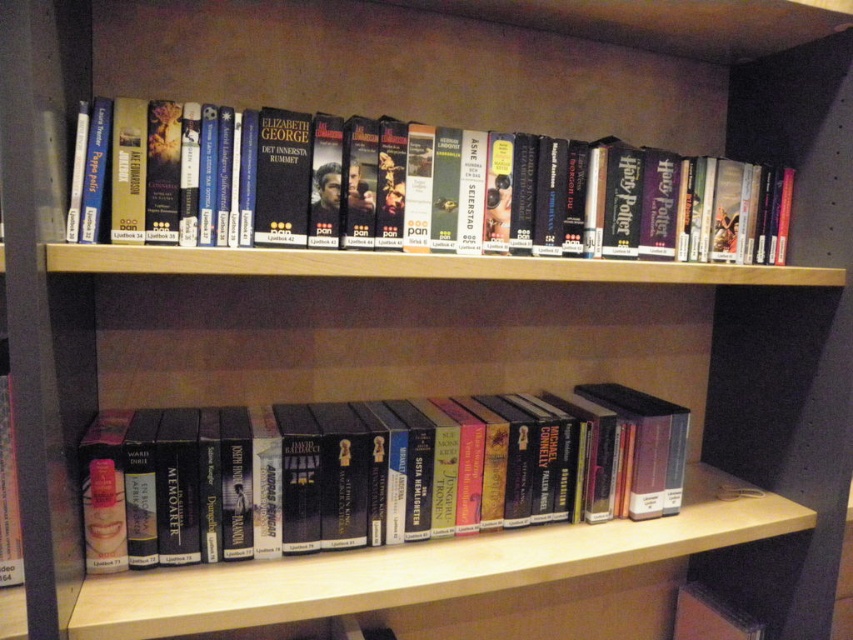
Can you confirm if hardcover book at center is bigger than hardcover book at upper center?

Yes, hardcover book at center is bigger than hardcover book at upper center.

In the scene shown: Can you confirm if hardcover book at center is positioned to the left of hardcover book at upper center?

Answer: Yes, hardcover book at center is to the left of hardcover book at upper center.

Where is `hardcover book at center`? This screenshot has width=853, height=640. hardcover book at center is located at coordinates (376, 472).